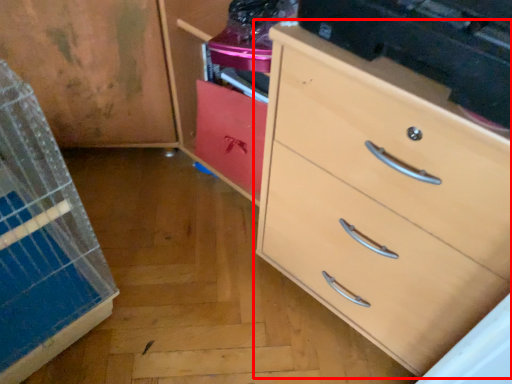
Question: From the image's perspective, what is the correct spatial positioning of chest of drawers (annotated by the red box) in reference to cabinetry?

Choices:
 (A) above
 (B) below

Answer: (B)